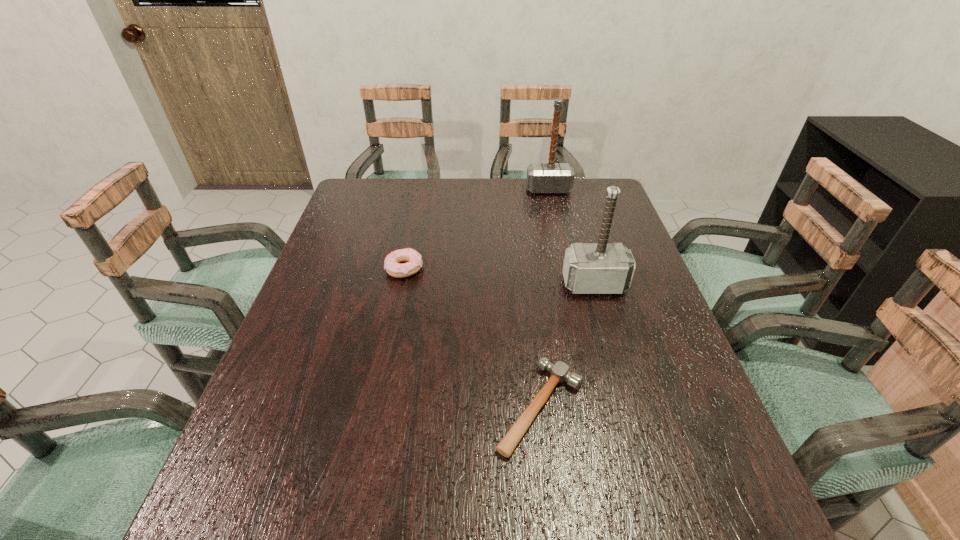
At what (x,y) coordinates should I click in order to perform the action: click on the farthest hammer. Please return your answer as a coordinate pair (x, y). Image resolution: width=960 pixels, height=540 pixels. Looking at the image, I should click on (551, 177).

At what (x,y) coordinates should I click in order to perform the action: click on the second nearest hammer. Please return your answer as a coordinate pair (x, y). The image size is (960, 540). Looking at the image, I should click on (592, 268).

Identify the location of doughnut. (413, 259).

Where is `the leftmost object`? The height and width of the screenshot is (540, 960). the leftmost object is located at coordinates (413, 259).

Where is `the nearest object`? The image size is (960, 540). the nearest object is located at coordinates (559, 372).

At what (x,y) coordinates should I click in order to perform the action: click on the nearest hammer. Please return your answer as a coordinate pair (x, y). Looking at the image, I should click on (559, 372).

Identify the location of free space located on the striking surface of the farthest hammer. (556, 221).

Find the location of a particular element. The width and height of the screenshot is (960, 540). vacant space positioned for striking with the head of the second farthest hammer is located at coordinates (609, 333).

Where is `free space located 0.070m on the front of the leftmost object`? The width and height of the screenshot is (960, 540). free space located 0.070m on the front of the leftmost object is located at coordinates (398, 299).

Locate an element on the screen. The width and height of the screenshot is (960, 540). free point located 0.130m on the front of the shortest hammer is located at coordinates (556, 538).